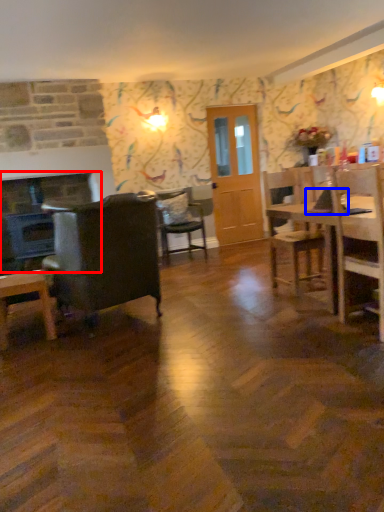
Question: Which object appears farthest to the camera in this image, fireplace (highlighted by a red box) or laptop (highlighted by a blue box)?

Choices:
 (A) fireplace
 (B) laptop

Answer: (A)